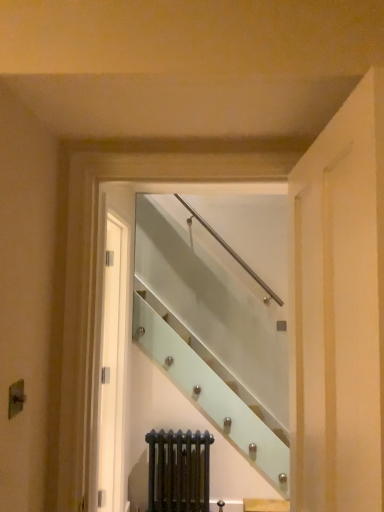
Question: Is dark green radiator at lower center closer to camera compared to clear glass staircase at center?

Choices:
 (A) yes
 (B) no

Answer: (B)

Question: Does dark green radiator at lower center appear on the right side of clear glass staircase at center?

Choices:
 (A) yes
 (B) no

Answer: (B)

Question: From the image's perspective, is dark green radiator at lower center located beneath clear glass staircase at center?

Choices:
 (A) no
 (B) yes

Answer: (B)

Question: Does dark green radiator at lower center lie behind clear glass staircase at center?

Choices:
 (A) no
 (B) yes

Answer: (B)

Question: From the image's perspective, is dark green radiator at lower center over clear glass staircase at center?

Choices:
 (A) no
 (B) yes

Answer: (A)

Question: Considering the relative positions of dark green radiator at lower center and clear glass staircase at center in the image provided, is dark green radiator at lower center to the left of clear glass staircase at center from the viewer's perspective?

Choices:
 (A) no
 (B) yes

Answer: (B)

Question: Is clear glass staircase at center positioned in front of dark green radiator at lower center?

Choices:
 (A) yes
 (B) no

Answer: (A)

Question: Is dark green radiator at lower center completely or partially inside clear glass staircase at center?

Choices:
 (A) yes
 (B) no

Answer: (B)

Question: Considering the relative sizes of clear glass staircase at center and dark green radiator at lower center in the image provided, is clear glass staircase at center thinner than dark green radiator at lower center?

Choices:
 (A) yes
 (B) no

Answer: (B)

Question: Does clear glass staircase at center have a lesser height compared to dark green radiator at lower center?

Choices:
 (A) no
 (B) yes

Answer: (A)

Question: From the image's perspective, is clear glass staircase at center above dark green radiator at lower center?

Choices:
 (A) no
 (B) yes

Answer: (B)

Question: Is clear glass staircase at center positioned with its back to dark green radiator at lower center?

Choices:
 (A) yes
 (B) no

Answer: (A)

Question: From their relative heights in the image, would you say clear glass staircase at center is taller or shorter than dark green radiator at lower center?

Choices:
 (A) tall
 (B) short

Answer: (A)